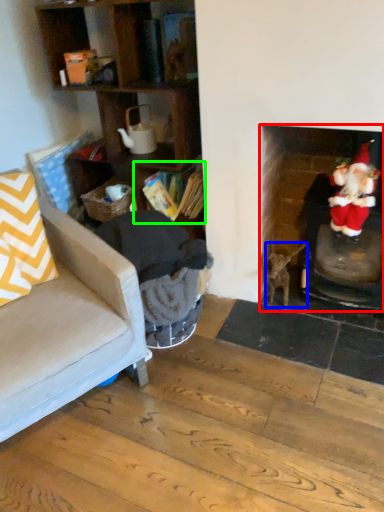
Question: Considering the real-world distances, which object is farthest from fireplace (highlighted by a red box)? animal (highlighted by a blue box) or shelf (highlighted by a green box)?

Choices:
 (A) animal
 (B) shelf

Answer: (B)